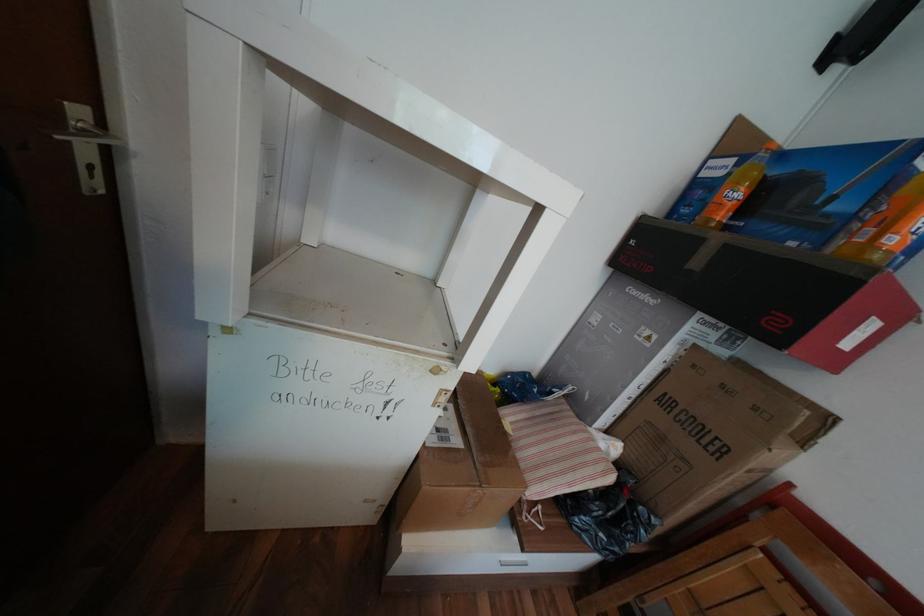
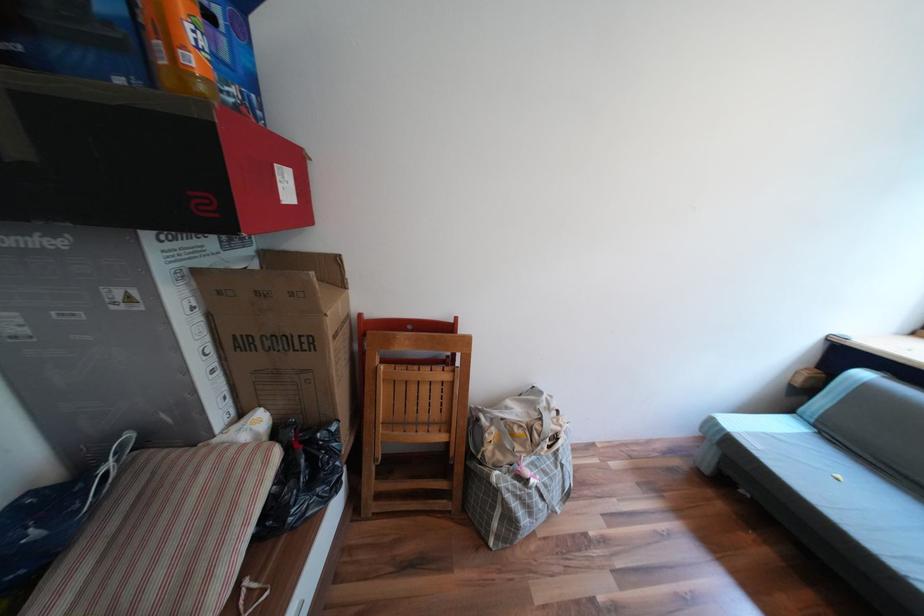
The point at [650,508] is marked in the first image. Where is the corresponding point in the second image?

(327, 435)